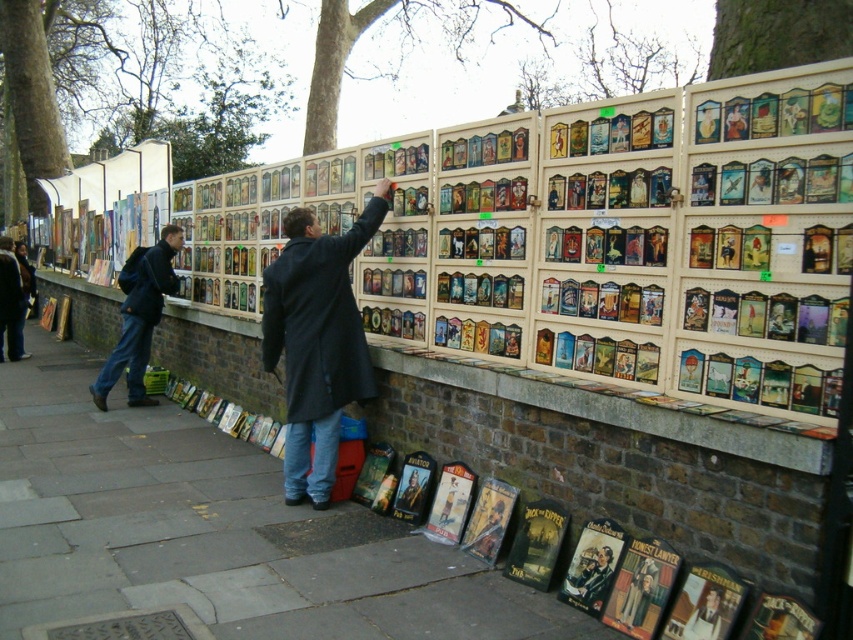
You are a photographer trying to capture the entire scene of the outdoor market. You notice the dark blue jeans at lower left and the matte black poster at center. Which object should you focus on to ensure both are in frame without cropping?

The dark blue jeans at lower left is bigger than the matte black poster at center, so focusing on the matte black poster at center would allow both objects to fit within the frame without cropping.

From the picture: You are standing in front of the outdoor market display. There are two points marked on the display board. Which point, point (589, 589) or point (704, 604), is closer to you?

Point (589, 589) is closer to you because it is further to the viewer than point (704, 604).

You are standing in front of the outdoor market display. You need to reach the matte black poster at center to pick up a card. Are the dark blue jeans at lower left in your way?

The dark blue jeans at lower left are in your way because they are closer to you than the matte black poster at center.